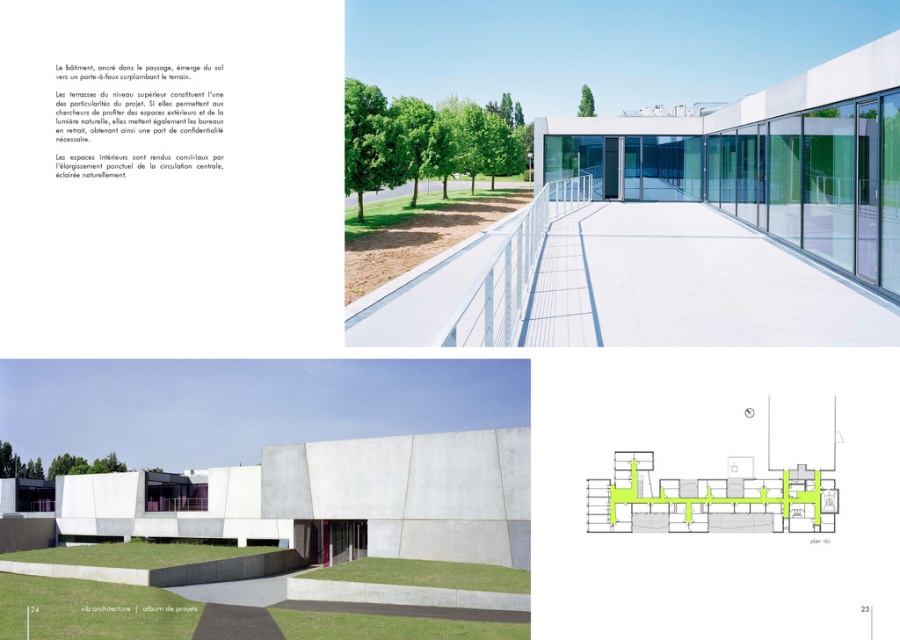
Question: Which of the following is the farthest from the observer?

Choices:
 (A) (729, 481)
 (B) (185, 513)

Answer: (B)

Question: Which of the following is the farthest from the observer?

Choices:
 (A) (747, 154)
 (B) (313, 490)

Answer: (B)

Question: Does white glass building at center appear over white concrete building at center?

Choices:
 (A) yes
 (B) no

Answer: (A)

Question: Which of the following is the closest to the observer?

Choices:
 (A) green concrete staircase at center
 (B) white concrete building at center
 (C) white glass building at center

Answer: (A)

Question: Does white glass building at center have a larger size compared to white concrete building at center?

Choices:
 (A) yes
 (B) no

Answer: (B)

Question: Can you confirm if white glass building at center is positioned to the left of white concrete building at center?

Choices:
 (A) yes
 (B) no

Answer: (B)